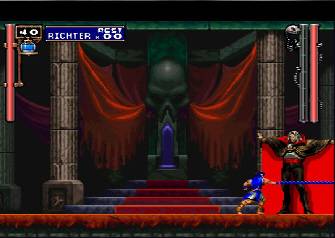
At what (x,y) coordinates should I click in order to perform the action: click on statue. Please return your answer as a coordinate pair (x, y). Looking at the image, I should click on (302, 150).